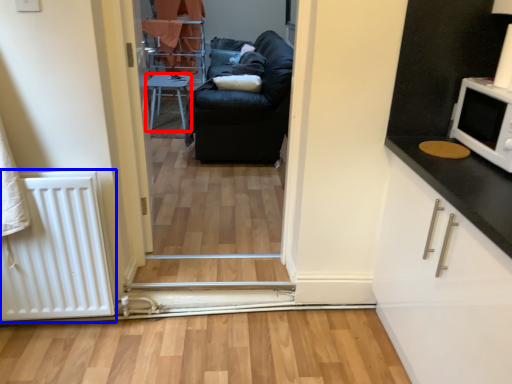
Question: Among these objects, which one is farthest to the camera, furniture (highlighted by a red box) or radiator (highlighted by a blue box)?

Choices:
 (A) furniture
 (B) radiator

Answer: (A)